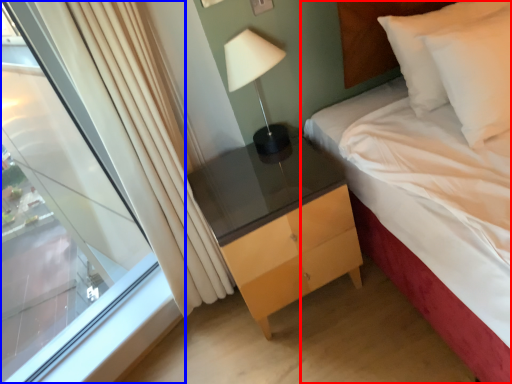
Question: Which point is further to the camera, bed (highlighted by a red box) or window (highlighted by a blue box)?

Choices:
 (A) bed
 (B) window

Answer: (B)